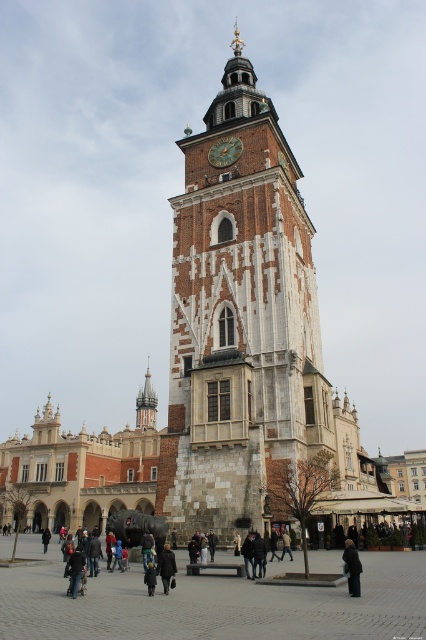
Question: Which point is farther to the camera?

Choices:
 (A) dark gray wool coat at center
 (B) dark brown leather coat at lower left
 (C) white stone clock tower at center

Answer: (B)

Question: Does gold textured clock at center appear under dark gray coat at center?

Choices:
 (A) yes
 (B) no

Answer: (B)

Question: Which object is positioned closest to the dark brown leather coat at lower left?

Choices:
 (A) dark gray coat at center
 (B) dark wool coat at center
 (C) dark gray wool coat at center

Answer: (C)

Question: Which of the following is the farthest from the observer?

Choices:
 (A) dark wool coat at center
 (B) dark brown leather coat at lower left
 (C) white stone clock tower at center

Answer: (B)

Question: Where is gold textured clock at center located in relation to dark gray wool coat at center in the image?

Choices:
 (A) above
 (B) below

Answer: (A)

Question: Is gold textured clock at center wider than dark brown leather jacket at center?

Choices:
 (A) no
 (B) yes

Answer: (B)